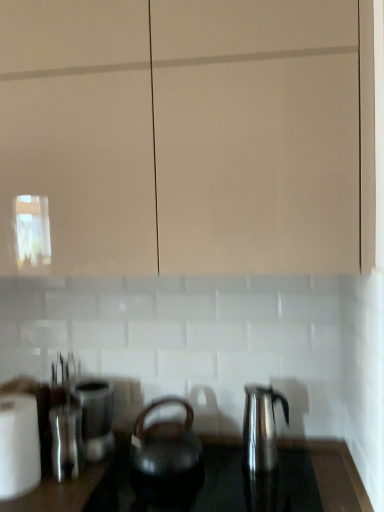
Question: Considering the positions of satin silver canister at left, the second appliance from the front, and shiny metallic kettle at right, positioned as the second kettle in left-to-right order, in the image, is satin silver canister at left, the second appliance from the front, taller or shorter than shiny metallic kettle at right, positioned as the second kettle in left-to-right order,?

Choices:
 (A) tall
 (B) short

Answer: (B)

Question: In terms of size, does satin silver canister at left, which ranks as the first appliance in back-to-front order, appear bigger or smaller than shiny metallic kettle at right, positioned as the second kettle in left-to-right order?

Choices:
 (A) big
 (B) small

Answer: (A)

Question: Which is farther from the shiny black kettle at center?

Choices:
 (A) transparent glass cabinet at upper center
 (B) satin silver canister at left, which ranks as the first appliance in back-to-front order
 (C) black matte kettle at center, positioned as the 2th kettle in right-to-left order
 (D) white glossy paper towel dispenser at left
 (E) satin silver kettle at left, which is the second appliance in back-to-front order

Answer: (A)

Question: Estimate the real-world distances between objects in this image. Which object is farther from the satin silver canister at left, which ranks as the first appliance in back-to-front order?

Choices:
 (A) satin silver kettle at left, which is the second appliance in back-to-front order
 (B) white glossy paper towel dispenser at left
 (C) transparent glass cabinet at upper center
 (D) shiny black kettle at center
 (E) shiny metallic kettle at right, the first kettle positioned from the right

Answer: (C)